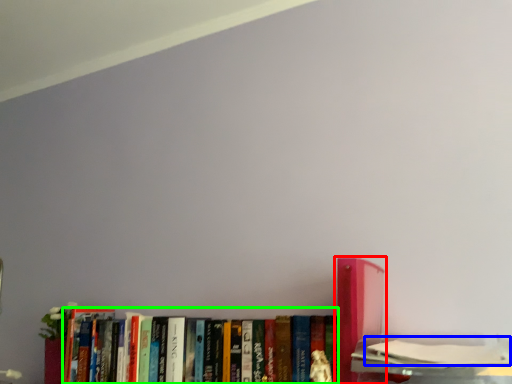
Question: Based on their relative distances, which object is farther from book (highlighted by a red box)? Choose from book (highlighted by a blue box) and book (highlighted by a green box).

Choices:
 (A) book
 (B) book

Answer: (B)